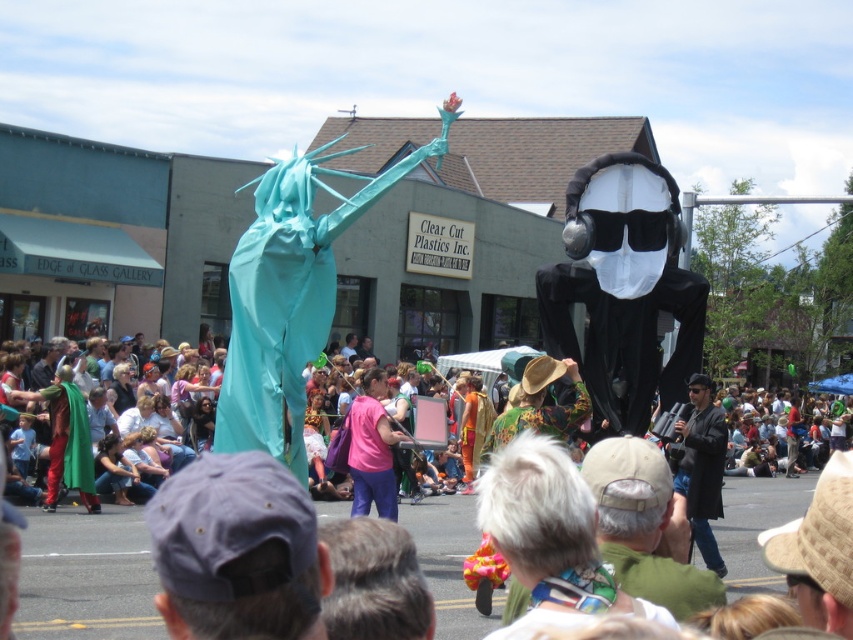
Question: Which point is farther from the camera taking this photo?

Choices:
 (A) (354, 465)
 (B) (688, 454)
 (C) (572, 244)
 (D) (199, 576)

Answer: (C)

Question: Is teal fabric statue at center closer to camera compared to pink fabric shirt at center?

Choices:
 (A) no
 (B) yes

Answer: (B)

Question: Which point appears farthest from the camera in this image?

Choices:
 (A) (x=202, y=497)
 (B) (x=352, y=195)
 (C) (x=700, y=477)

Answer: (B)

Question: Can you confirm if black matte ghost at center is wider than black leather jacket at center?

Choices:
 (A) no
 (B) yes

Answer: (B)

Question: Is teal fabric statue at center bigger than dark blue fabric cap at center?

Choices:
 (A) no
 (B) yes

Answer: (B)

Question: Which object is positioned closest to the pink fabric shirt at center?

Choices:
 (A) dark blue fabric cap at center
 (B) black leather jacket at center

Answer: (B)